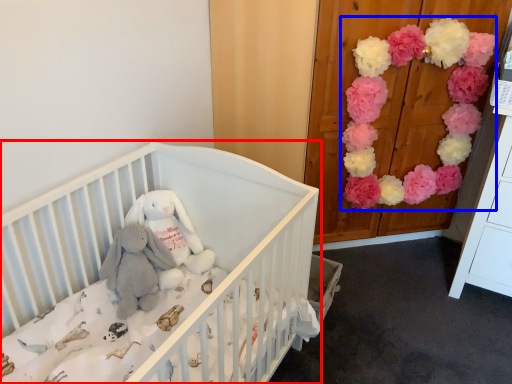
Question: Which object is closer to the camera taking this photo, infant bed (highlighted by a red box) or flower (highlighted by a blue box)?

Choices:
 (A) infant bed
 (B) flower

Answer: (A)